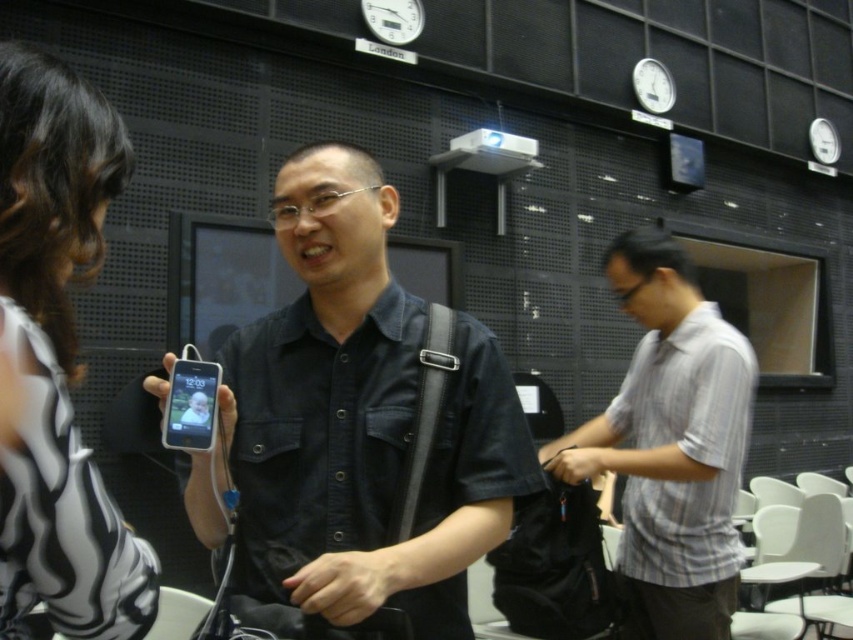
You are organizing a photo shoot in this room and need to place two mannequins wearing the black denim shirt at center and the gray striped shirt at right. Which mannequin should you place closer to the wall to ensure they don not block the clocks on the dark perforated wall?

The black denim shirt at center has a smaller width than the gray striped shirt at right, so the mannequin wearing the black denim shirt at center should be placed closer to the wall to prevent blocking the clocks since it takes up less space.

You are attending a virtual meeting in this conference room and notice two participants wearing different shirts. The black denim shirt at center and the gray striped shirt at right. Which participant is standing closer to the left side of the room?

The black denim shirt at center is positioned on the left side of gray striped shirt at right, so the participant wearing the black denim shirt at center is standing closer to the left side of the room.

You are standing in the conference room and need to locate two specific points marked on the wall. The first point is at coordinates point (41, 566) and the second at point (672, 248). Which of these points is closer to you?

Point (41, 566) is in front of point (672, 248), so it is closer to you.